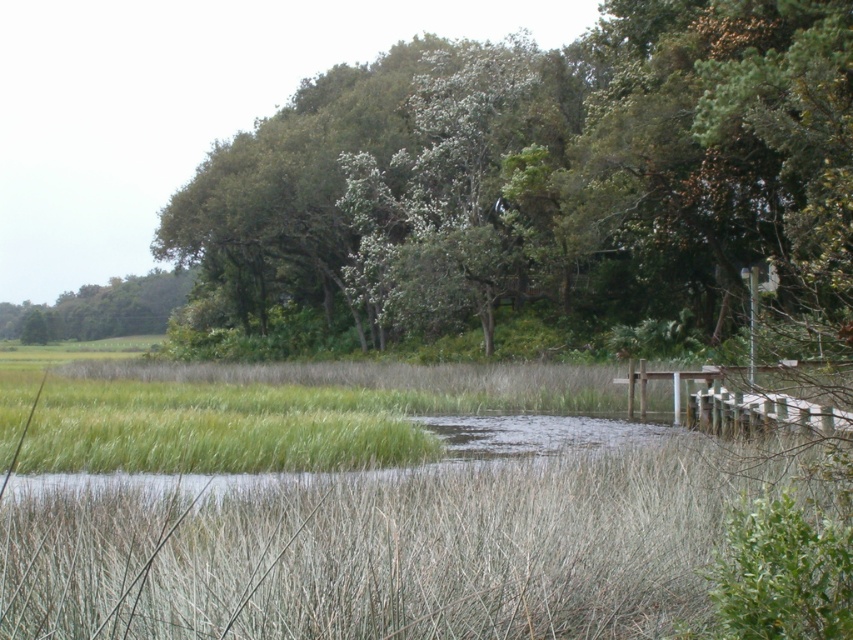
Can you confirm if green leafy tree at upper center is positioned to the right of green leafy tree at upper left?

Correct, you'll find green leafy tree at upper center to the right of green leafy tree at upper left.

Is green leafy tree at upper center taller than green leafy tree at upper left?

Yes.

The height and width of the screenshot is (640, 853). Find the location of `green leafy tree at upper center`. green leafy tree at upper center is located at coordinates (543, 189).